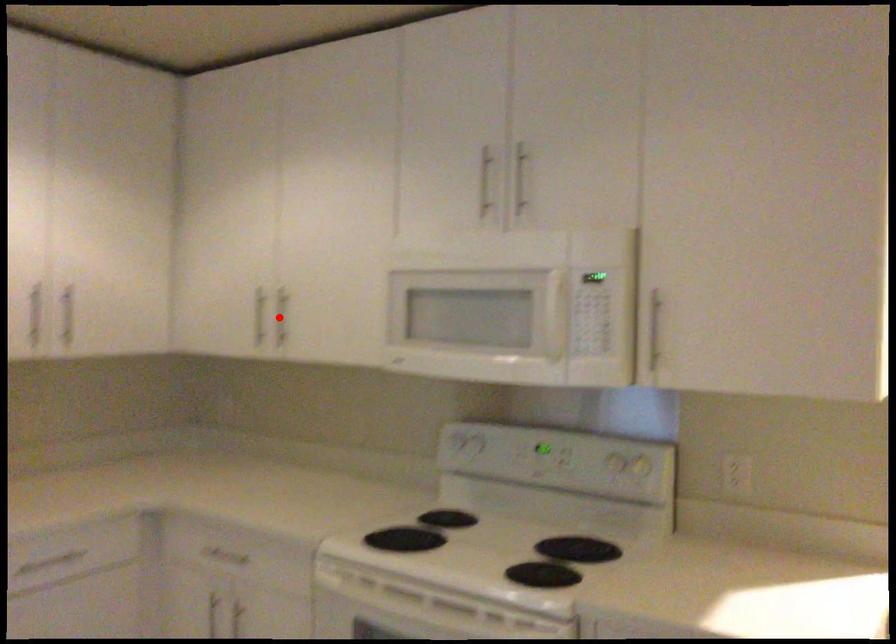
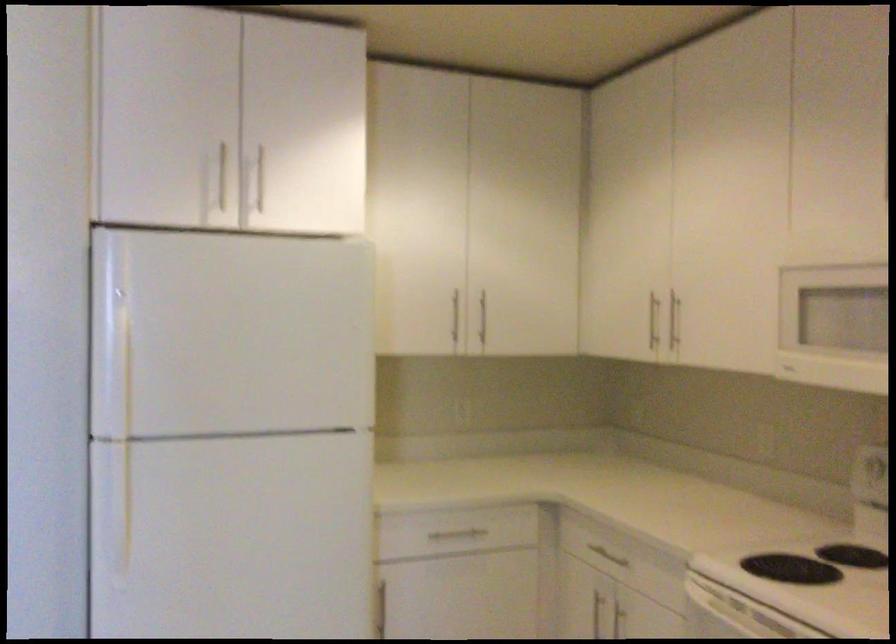
Find the pixel in the second image that matches the highlighted location in the first image.

(673, 321)